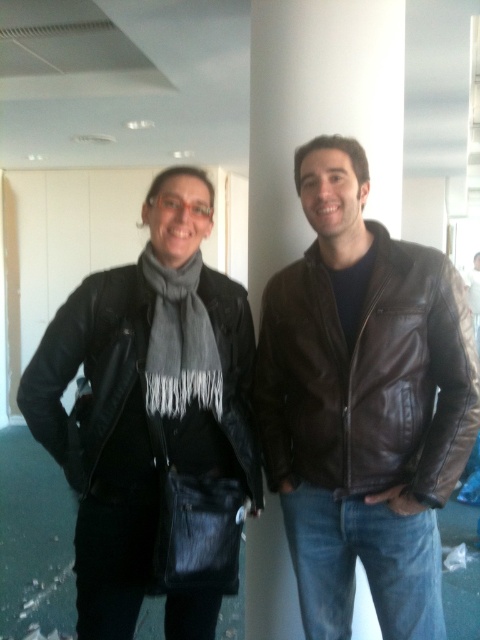
Does brown leather jacket at center have a lesser height compared to black leather jacket at left?

No, brown leather jacket at center is not shorter than black leather jacket at left.

Describe the element at coordinates (363, 403) in the screenshot. The height and width of the screenshot is (640, 480). I see `brown leather jacket at center` at that location.

Where is `brown leather jacket at center`? brown leather jacket at center is located at coordinates (363, 403).

Describe the element at coordinates (363, 403) in the screenshot. I see `brown leather jacket at center` at that location.

Which of these two, brown leather jacket at center or gray woolen scarf at center, stands shorter?

gray woolen scarf at center

Does point (308, 378) come closer to viewer compared to point (188, 355)?

No, (308, 378) is further to viewer.

In order to click on brown leather jacket at center in this screenshot , I will do `click(363, 403)`.

The image size is (480, 640). Describe the element at coordinates (88, 368) in the screenshot. I see `black leather jacket at left` at that location.

Which of these two, black leather jacket at left or gray woolen scarf at center, stands taller?

black leather jacket at left

Between point (230, 336) and point (188, 268), which one is positioned behind?

The point (230, 336) is more distant.

Image resolution: width=480 pixels, height=640 pixels. What are the coordinates of `black leather jacket at left` in the screenshot? It's located at (88, 368).